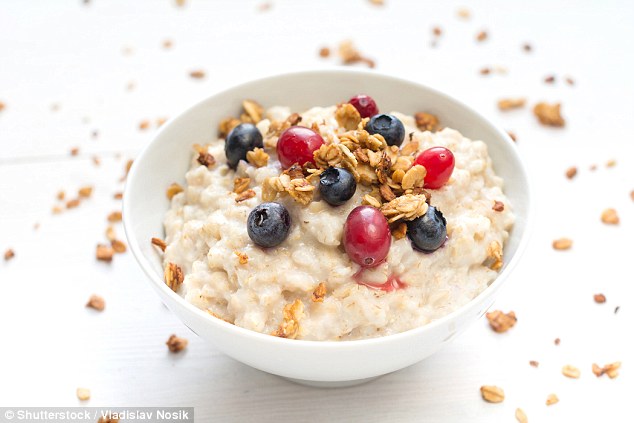
I want to click on table, so click(75, 74).